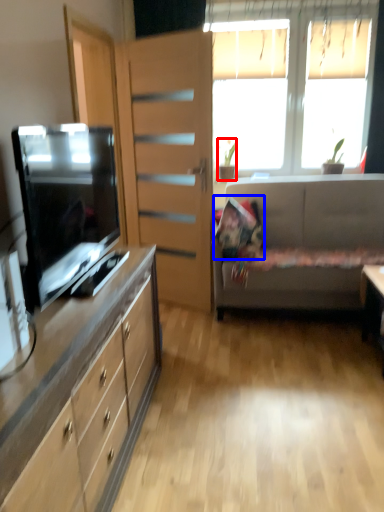
Question: Which object is closer to the camera taking this photo, houseplant (highlighted by a red box) or pillow (highlighted by a blue box)?

Choices:
 (A) houseplant
 (B) pillow

Answer: (B)